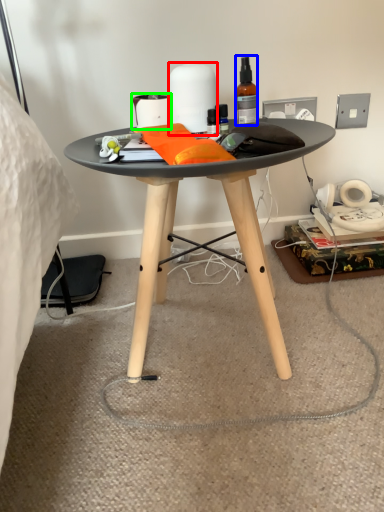
Question: Which is farther away from toilet paper (highlighted by a red box)? bottle (highlighted by a blue box) or toilet paper (highlighted by a green box)?

Choices:
 (A) bottle
 (B) toilet paper

Answer: (A)